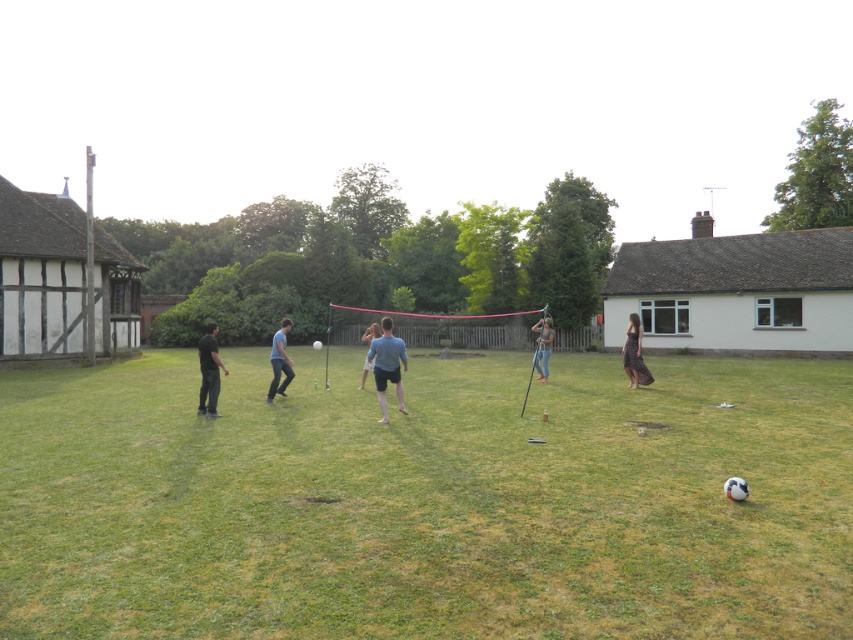
Between light blue shirt at center and black matte shirt at left, which one is positioned higher?

black matte shirt at left is higher up.

Locate an element on the screen. This screenshot has height=640, width=853. light blue shirt at center is located at coordinates (387, 365).

Identify the location of light blue shirt at center. (387, 365).

Is point (631, 380) positioned behind point (276, 381)?

Yes, it is behind point (276, 381).

Where is `black lace dress at right`? black lace dress at right is located at coordinates (634, 355).

Which of these two, green grass at center or black matte shirt at left, stands shorter?

With less height is green grass at center.

Is green grass at center below black matte shirt at left?

Correct, green grass at center is located below black matte shirt at left.

Which is in front, point (245, 348) or point (213, 323)?

Point (213, 323)

The height and width of the screenshot is (640, 853). What are the coordinates of `green grass at center` in the screenshot? It's located at (427, 500).